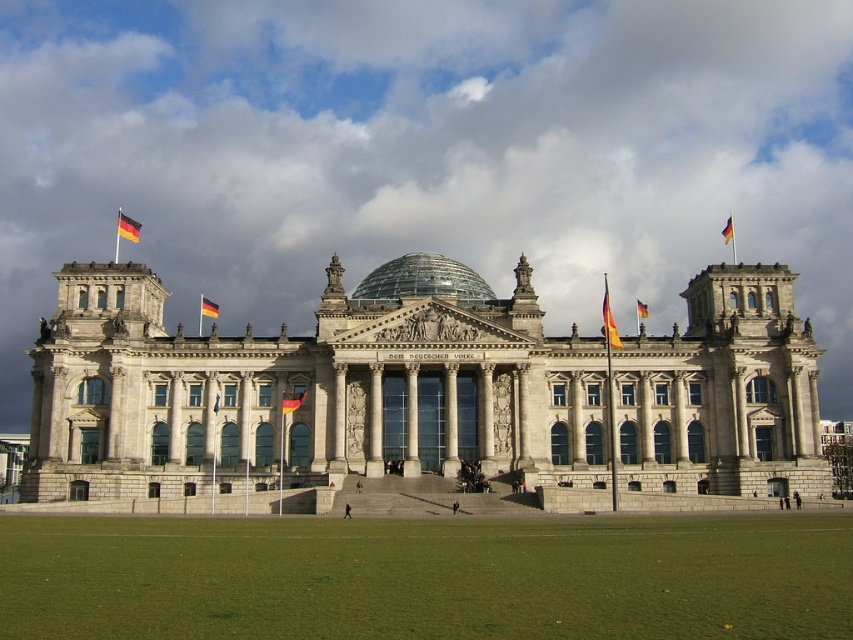
Does point (535, 320) lie behind point (209, 316)?

No, it is in front of (209, 316).

Between white stone building at center and yellowmaterial/textureflag at upper left, which one is positioned lower?

white stone building at center is lower down.

Consider the image. Who is more forward, (381, 428) or (200, 304)?

Positioned in front is point (381, 428).

Where is `white stone building at center`? This screenshot has height=640, width=853. white stone building at center is located at coordinates (422, 392).

Between green grass at lower center and yellow and black striped fabric at center, which one has less height?

Standing shorter between the two is yellow and black striped fabric at center.

Which is below, green grass at lower center or yellow and black striped fabric at center?

green grass at lower center

Locate an element on the screen. The width and height of the screenshot is (853, 640). green grass at lower center is located at coordinates (427, 577).

Does yellow and black striped fabric at center have a lesser height compared to yellow and red fabric flag at center?

In fact, yellow and black striped fabric at center may be taller than yellow and red fabric flag at center.

In the scene shown: Is yellow and black striped fabric at center to the right of yellow and red fabric flag at center from the viewer's perspective?

No, yellow and black striped fabric at center is not to the right of yellow and red fabric flag at center.

Does point (305, 394) lie behind point (639, 317)?

No, (305, 394) is in front of (639, 317).

This screenshot has width=853, height=640. Find the location of `yellow and black striped fabric at center`. yellow and black striped fabric at center is located at coordinates click(292, 401).